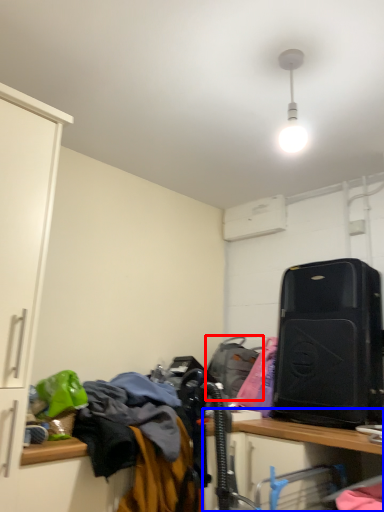
Question: Among these objects, which one is nearest to the camera, luggage and bags (highlighted by a red box) or computer desk (highlighted by a blue box)?

Choices:
 (A) luggage and bags
 (B) computer desk

Answer: (B)